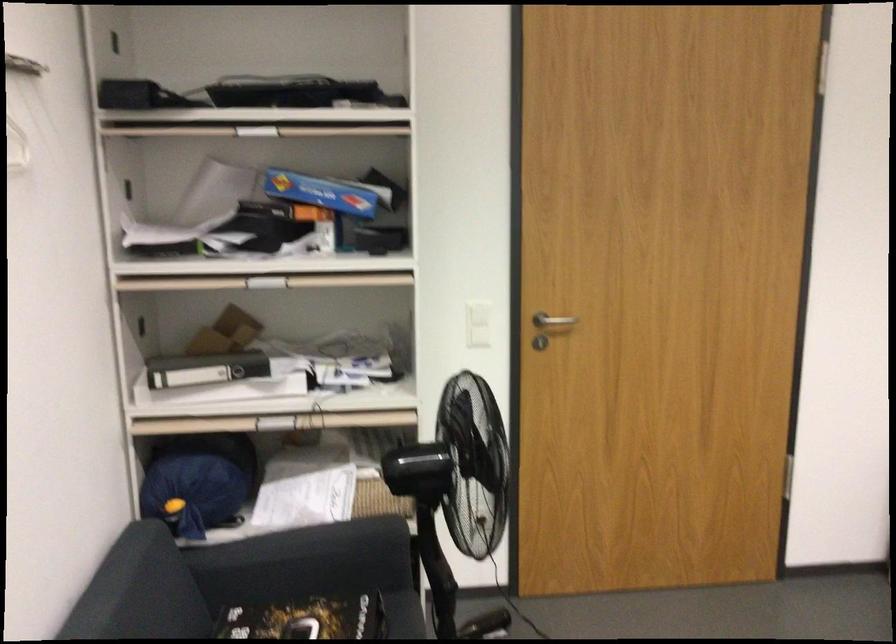
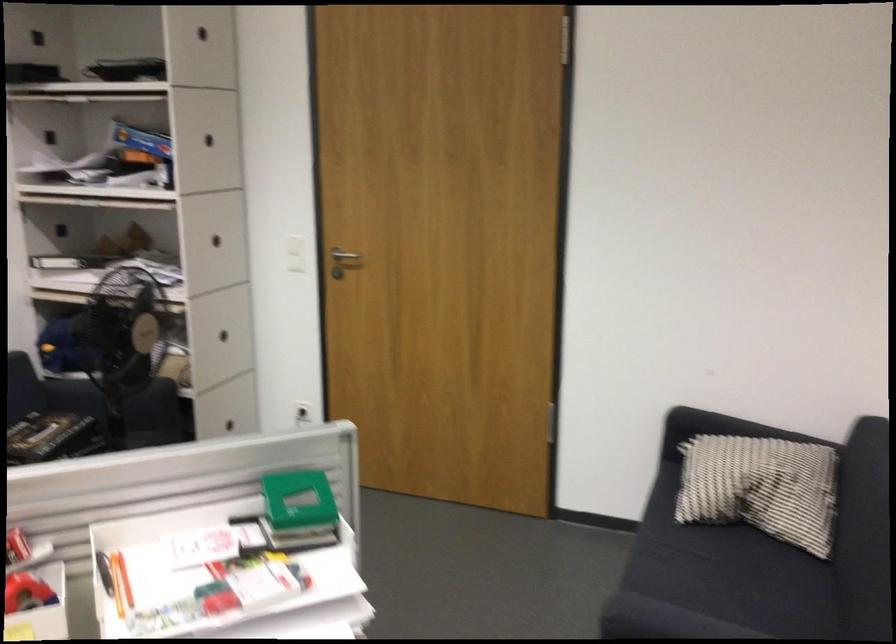
Question: What movement of the cameraman would produce the second image?

Choices:
 (A) Left
 (B) Right
 (C) Forward
 (D) Backward

Answer: (B)